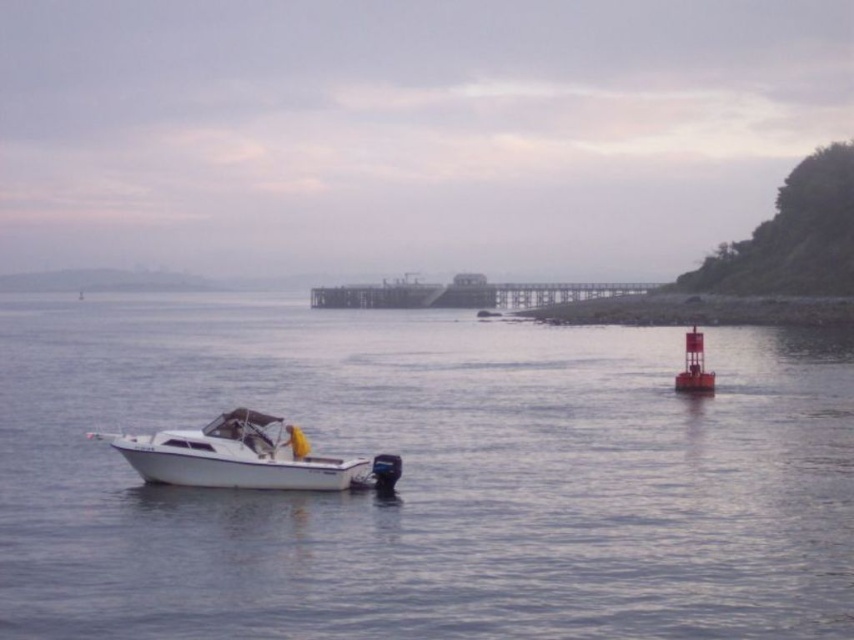
Identify the location of white smooth water at center. (424, 476).

Can you confirm if white smooth water at center is positioned below white glossy boat at lower left?

No.

Is white smooth water at center shorter than white glossy boat at lower left?

In fact, white smooth water at center may be taller than white glossy boat at lower left.

Is point (174, 412) positioned behind point (367, 460)?

Yes, point (174, 412) is farther from viewer.

Find the location of a particular element. white smooth water at center is located at coordinates (424, 476).

Is point (247, 444) less distant than point (572, 291)?

That is True.

Is point (159, 436) in front of point (461, 280)?

Yes, it is in front of point (461, 280).

Identify the location of white glossy boat at lower left. (247, 458).